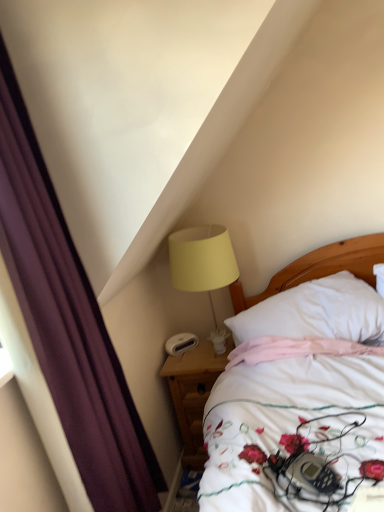
At what (x,y) coordinates should I click in order to perform the action: click on free spot to the right of white plastic alarm clock at lower center. Please return your answer as a coordinate pair (x, y). This screenshot has width=384, height=512. Looking at the image, I should click on (206, 342).